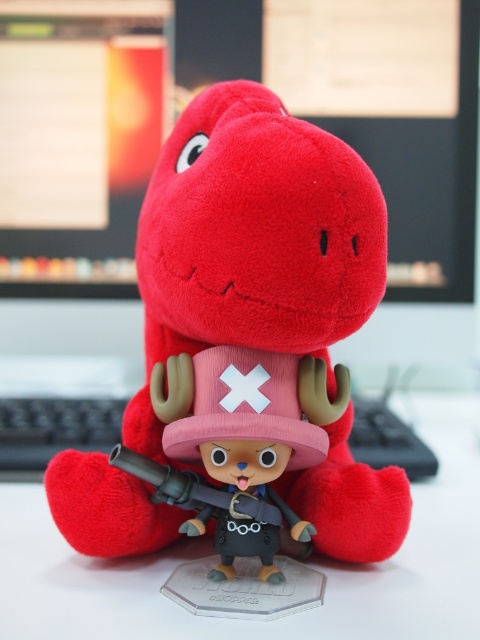
Which is more to the right, velvet plush dinosaur at center or white glossy computer desk at center?

white glossy computer desk at center is more to the right.

Locate an element on the screen. velvet plush dinosaur at center is located at coordinates (253, 237).

You are a GUI agent. You are given a task and a screenshot of the screen. Output one action in this format:
    pyautogui.click(x=<x>, y=<y>)
    Task: Click on the velvet plush dinosaur at center
    
    Given the screenshot: What is the action you would take?
    pyautogui.click(x=253, y=237)